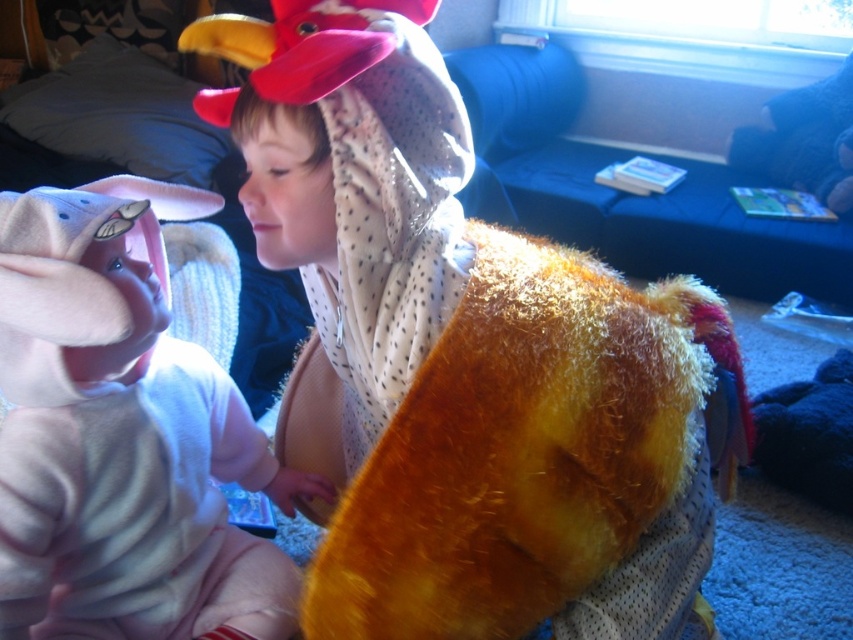
You are a parent trying to store the fuzzy yellow costume at center and the soft pink plush toy at left in a closet. The closet shelf can only hold items that are narrower than 18 inches. Based on the scene, can both items fit on the shelf?

The fuzzy yellow costume at center might be wider than soft pink plush toy at left. Since the shelf can only hold items narrower than 18 inches, it is uncertain if both will fit. The parent should check the exact width of the fuzzy yellow costume at center before deciding.

You are standing in the living room and want to pick up an object. Which point, point (x=614, y=388) or point (x=3, y=582), is easier to reach because it is closer to you?

Point (x=614, y=388) is closer to the camera than point (x=3, y=582), so it is easier to reach.